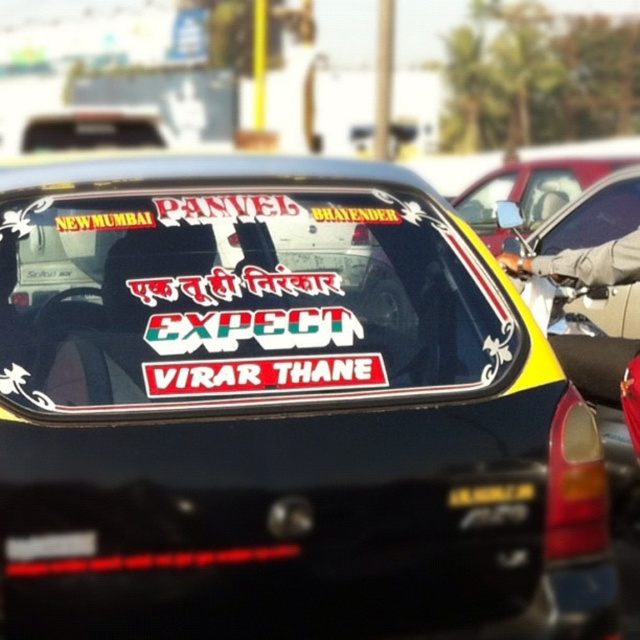
Does point (397, 218) come farther from viewer compared to point (547, 216)?

No, it is in front of (547, 216).

Does matte vinyl sticker at center have a greater width compared to yellow matte car at center?

In fact, matte vinyl sticker at center might be narrower than yellow matte car at center.

Image resolution: width=640 pixels, height=640 pixels. Describe the element at coordinates (240, 301) in the screenshot. I see `matte vinyl sticker at center` at that location.

Where is `matte vinyl sticker at center`? The image size is (640, 640). matte vinyl sticker at center is located at coordinates (240, 301).

Who is positioned more to the left, matte vinyl sticker at center or white matte sticker at center?

matte vinyl sticker at center

Who is taller, matte vinyl sticker at center or white matte sticker at center?

Standing taller between the two is matte vinyl sticker at center.

Who is more forward, [358,196] or [369,372]?

Positioned in front is point [369,372].

Locate an element on the screen. The height and width of the screenshot is (640, 640). matte vinyl sticker at center is located at coordinates (240, 301).

Is white matte sticker at center below yellow matte car at center?

Correct, white matte sticker at center is located below yellow matte car at center.

Does point (268, 372) come behind point (552, 157)?

No, it is in front of (552, 157).

Locate an element on the screen. white matte sticker at center is located at coordinates (264, 376).